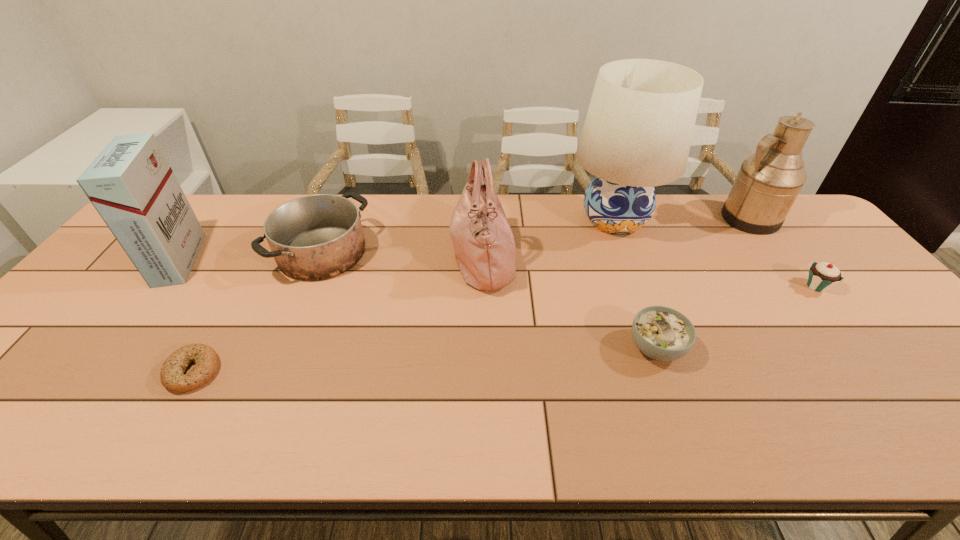
Locate an element on the screen. the tallest object is located at coordinates (637, 134).

Image resolution: width=960 pixels, height=540 pixels. What are the coordinates of `pitcher` in the screenshot? It's located at (768, 182).

This screenshot has width=960, height=540. Find the location of `the leftmost object`. the leftmost object is located at coordinates (130, 183).

You are a GUI agent. You are given a task and a screenshot of the screen. Output one action in this format:
    pyautogui.click(x=<x>, y=<y>)
    Task: Click on the fourth object from left to right
    This screenshot has height=540, width=960.
    Given the screenshot: What is the action you would take?
    pyautogui.click(x=483, y=242)

Where is `the fourth shortest object`? the fourth shortest object is located at coordinates (316, 237).

The width and height of the screenshot is (960, 540). I want to click on cupcake, so click(x=822, y=276).

Where is `soup bowl`? The width and height of the screenshot is (960, 540). soup bowl is located at coordinates (662, 333).

Where is `bagel`? bagel is located at coordinates (172, 377).

At what (x,y) coordinates should I click in order to perform the action: click on vacant area situated 0.170m on the front-facing side of the lampshade. Please return your answer as a coordinate pair (x, y). Looking at the image, I should click on (641, 291).

Locate an element on the screen. vacant region located 0.070m on the front of the pitcher is located at coordinates (773, 249).